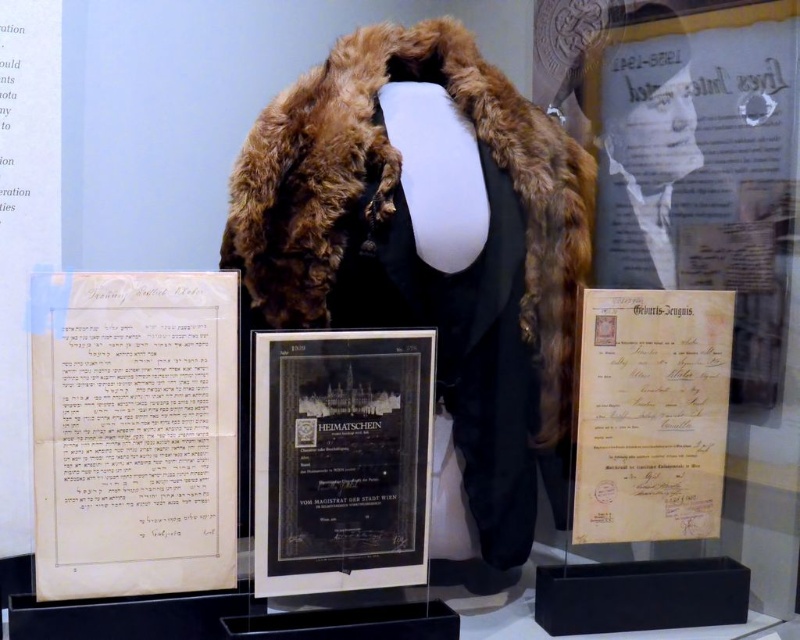
Question: Based on their relative distances, which object is nearer to the brown fur coat at center?

Choices:
 (A) black glass plaque at center
 (B) yellow paper document at center
 (C) white paper document at left

Answer: (B)

Question: Can you confirm if brown fur coat at center is wider than yellow paper document at center?

Choices:
 (A) yes
 (B) no

Answer: (A)

Question: Can you confirm if brown fur coat at center is positioned below yellow paper document at center?

Choices:
 (A) no
 (B) yes

Answer: (A)

Question: Which of the following is the farthest from the observer?

Choices:
 (A) [56, 371]
 (B) [292, 496]

Answer: (B)

Question: Which object appears closest to the camera in this image?

Choices:
 (A) black glass plaque at center
 (B) white paper document at left

Answer: (B)

Question: Is brown fur coat at center wider than white paper document at left?

Choices:
 (A) no
 (B) yes

Answer: (B)